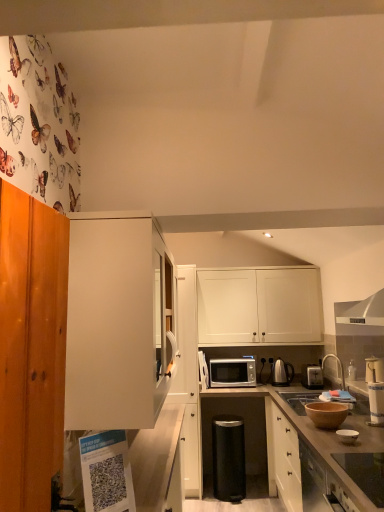
Find the location of a particular element. The height and width of the screenshot is (512, 384). empty space that is ontop of brown matte bowl at lower right (from a real-world perspective) is located at coordinates (328, 403).